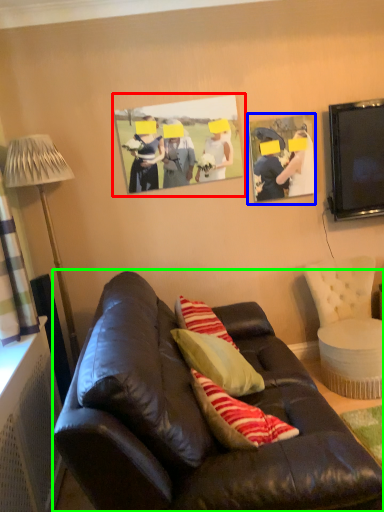
Question: Considering the real-world distances, which object is farthest from picture frame (highlighted by a red box)? picture frame (highlighted by a blue box) or studio couch (highlighted by a green box)?

Choices:
 (A) picture frame
 (B) studio couch

Answer: (B)